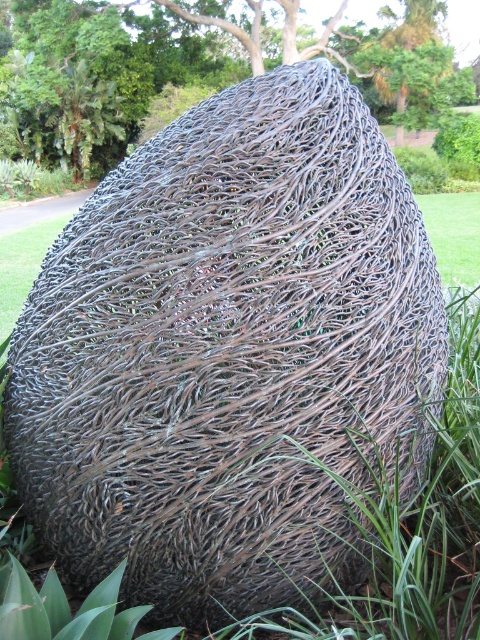
You are a gardener planning to place a new decorative rock next to the brown textured root at center and the green grass at center. Which object should you place the rock closer to if you want it to be proportionally smaller compared to its neighboring object?

You should place the rock closer to the green grass at center because the brown textured root at center is larger in size than the green grass at center, so placing the rock near the smaller grass would make it proportionally smaller in comparison.

You are standing at the entrance of the park and see the brown textured root at center. If you walk straight towards it, how far will you have to walk to reach it?

The brown textured root at center is 26.35 meters away from your current position, so you will have to walk 26.35 meters to reach it.

You are a landscape architect designing a garden path. You need to place a decorative stone between the brown textured root at center and the green grass at center. Which object should the stone be closer to if it must be placed closer to the wider object?

The brown textured root at center has a larger width than the green grass at center, so the stone should be placed closer to the brown textured root at center.